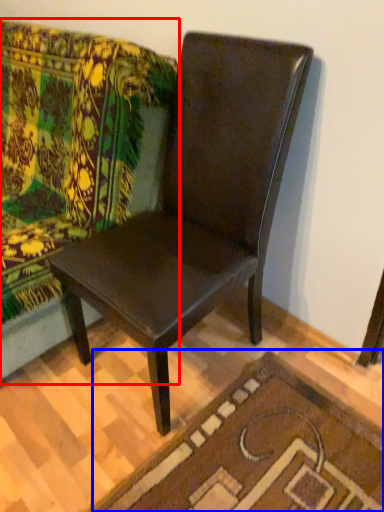
Question: Which object is closer to the camera taking this photo, studio couch (highlighted by a red box) or doormat (highlighted by a blue box)?

Choices:
 (A) studio couch
 (B) doormat

Answer: (A)